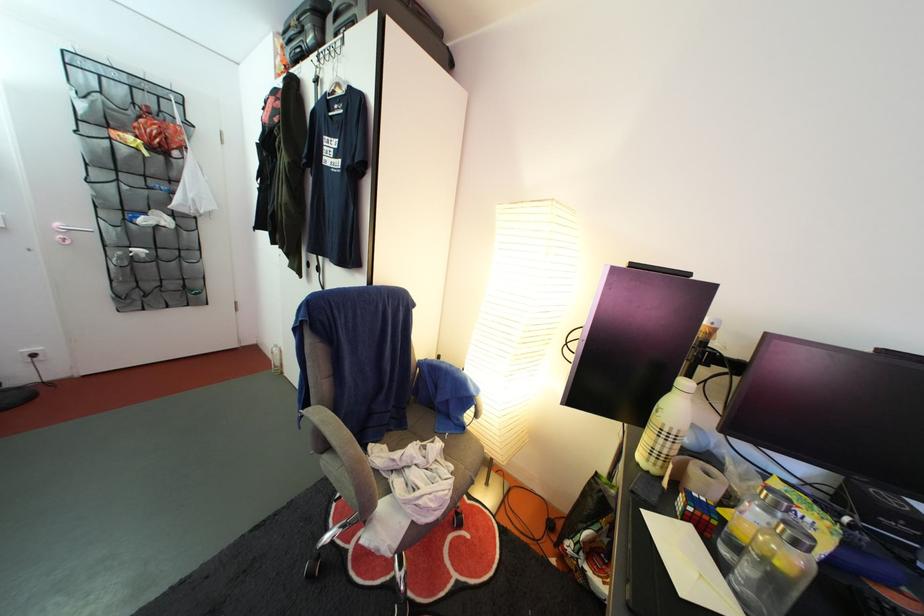
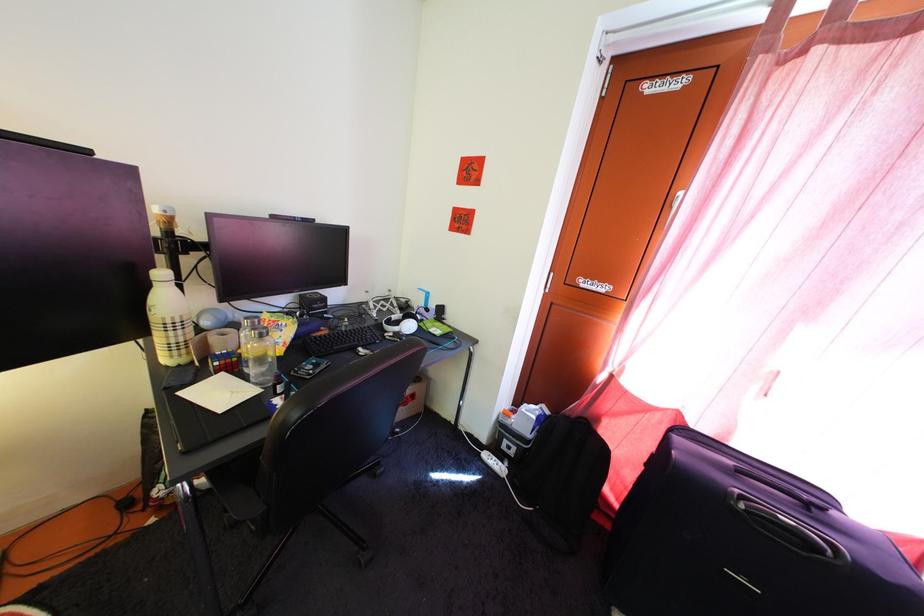
Where in the second image is the point corresponding to (x=795, y=532) from the first image?

(262, 338)